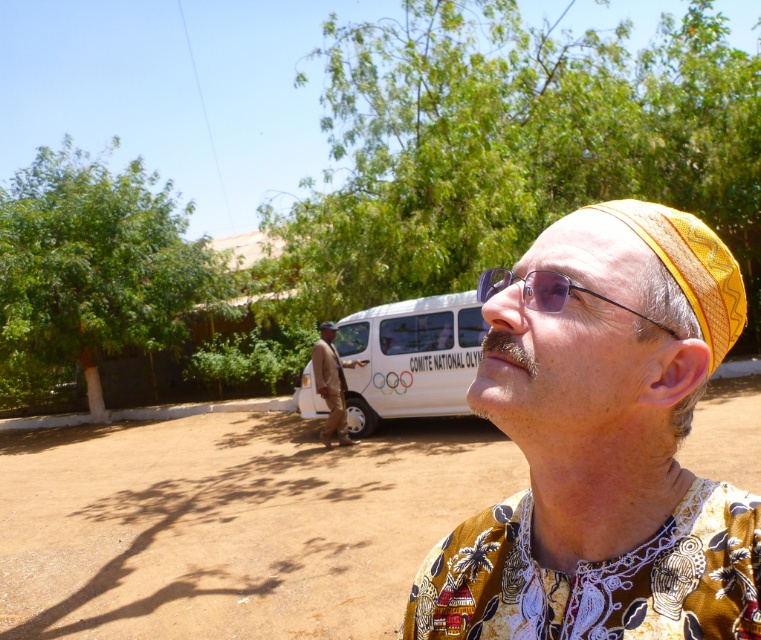
You are a photographer trying to capture a clear shot of the transparent plastic glasses at center without the brown sandy dirt at lower center appearing in the foreground. Based on their relative heights, what adjustment could you make to your camera angle?

Since the brown sandy dirt at lower center is much taller than the transparent plastic glasses at center, you can lower your camera angle to position the glasses above the dirt in the frame, ensuring the dirt doesn not block the view.

In the scene shown: You are a photographer trying to capture the yellow woven hat at upper right in your shot. The van is parked at the dirt road. Where should you position yourself relative to the van to ensure the hat is in the frame?

The yellow woven hat at upper right is located at point (x=600, y=444), so you should position yourself to the upper right of the van to include the hat in your shot.

Looking at this image, you are standing in front of the white van parked on the dirt road and want to place a marker at two specific points. The first point is at coordinate point (517,600) and the second is at point (473,346). Which point is closer to you?

Point (517,600) is closer to the viewer than point (473,346).